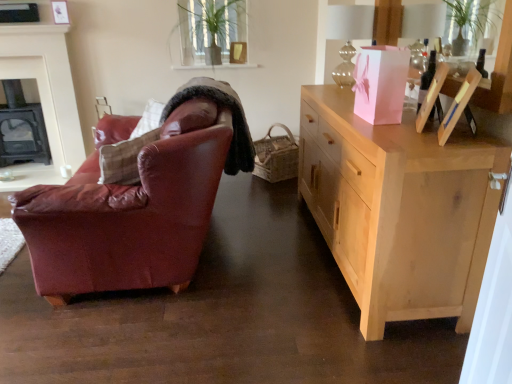
Locate an element on the screen. woven brown picnic basket at center is located at coordinates (276, 156).

The height and width of the screenshot is (384, 512). What do you see at coordinates (45, 92) in the screenshot?
I see `black cast iron fireplace at left, which is the first fireplace from front to back` at bounding box center [45, 92].

Identify the location of natural wood cabinet at right. (399, 209).

From the image's perspective, which is above, green leafy plant at upper center or natural wood cabinet at right?

green leafy plant at upper center, from the image's perspective.

Is point (191, 45) behind point (490, 207)?

That is True.

The height and width of the screenshot is (384, 512). In the image, there is a natural wood cabinet at right. Find the location of `plant above it (from the image's perspective)`. plant above it (from the image's perspective) is located at coordinates (210, 28).

Is green leafy plant at upper center oriented away from natural wood cabinet at right?

green leafy plant at upper center is not turned away from natural wood cabinet at right.

Is black cast iron fireplace at left, the 2th fireplace in the front-to-back sequence, positioned with its back to green leafy plant at upper center?

No, black cast iron fireplace at left, the 2th fireplace in the front-to-back sequence, is not facing away from green leafy plant at upper center.

Does point (42, 156) come closer to viewer compared to point (187, 60)?

No, it is behind (187, 60).

Would you say black cast iron fireplace at left, the 2th fireplace in the front-to-back sequence, is outside green leafy plant at upper center?

Yes, black cast iron fireplace at left, the 2th fireplace in the front-to-back sequence, is outside of green leafy plant at upper center.

What's the angular difference between black cast iron fireplace at left, the 2th fireplace in the front-to-back sequence, and black cast iron fireplace at left, which is the first fireplace from front to back,'s facing directions?

black cast iron fireplace at left, the 2th fireplace in the front-to-back sequence, and black cast iron fireplace at left, which is the first fireplace from front to back, are facing 0.765 degrees away from each other.

Does point (24, 141) come in front of point (69, 85)?

That is False.

Can you confirm if black cast iron fireplace at left, the 2th fireplace in the front-to-back sequence, is positioned to the right of black cast iron fireplace at left, the 2th fireplace from the back?

No.

Could you tell me if black cast iron fireplace at left, the 2th fireplace in the front-to-back sequence, is turned towards black cast iron fireplace at left, which is the first fireplace from front to back?

Yes, black cast iron fireplace at left, the 2th fireplace in the front-to-back sequence, faces towards black cast iron fireplace at left, which is the first fireplace from front to back.

Considering the relative sizes of green leafy plant at upper center and woven brown picnic basket at center in the image provided, is green leafy plant at upper center bigger than woven brown picnic basket at center?

Yes.

Would you say woven brown picnic basket at center is part of green leafy plant at upper center's contents?

No, woven brown picnic basket at center is not a part of green leafy plant at upper center.

Which object is positioned more to the left, green leafy plant at upper center or woven brown picnic basket at center?

Positioned to the left is green leafy plant at upper center.

Considering the relative sizes of woven brown picnic basket at center and black cast iron fireplace at left, the 2th fireplace from the back, in the image provided, is woven brown picnic basket at center smaller than black cast iron fireplace at left, the 2th fireplace from the back,?

No.

Is woven brown picnic basket at center far away from black cast iron fireplace at left, the 2th fireplace from the back?

That's right, there is a large distance between woven brown picnic basket at center and black cast iron fireplace at left, the 2th fireplace from the back.

From the image's perspective, which is above, woven brown picnic basket at center or black cast iron fireplace at left, which is the first fireplace from front to back?

black cast iron fireplace at left, which is the first fireplace from front to back, is shown above in the image.

Considering the sizes of objects black cast iron fireplace at left, the 2th fireplace in the front-to-back sequence, and natural wood cabinet at right in the image provided, who is smaller, black cast iron fireplace at left, the 2th fireplace in the front-to-back sequence, or natural wood cabinet at right?

Smaller between the two is black cast iron fireplace at left, the 2th fireplace in the front-to-back sequence.

Between black cast iron fireplace at left, the 2th fireplace in the front-to-back sequence, and natural wood cabinet at right, which one appears on the left side from the viewer's perspective?

Positioned to the left is black cast iron fireplace at left, the 2th fireplace in the front-to-back sequence.

Is natural wood cabinet at right at the back of black cast iron fireplace at left, the 2th fireplace in the front-to-back sequence?

No, black cast iron fireplace at left, the 2th fireplace in the front-to-back sequence, is not facing away from natural wood cabinet at right.

Can you confirm if woven brown picnic basket at center is taller than black cast iron fireplace at left, marked as the 1th fireplace in a back-to-front arrangement?

No.

Does woven brown picnic basket at center appear on the right side of black cast iron fireplace at left, the 2th fireplace in the front-to-back sequence?

Yes, woven brown picnic basket at center is to the right of black cast iron fireplace at left, the 2th fireplace in the front-to-back sequence.

Does woven brown picnic basket at center have a greater width compared to black cast iron fireplace at left, the 2th fireplace in the front-to-back sequence?

Indeed, woven brown picnic basket at center has a greater width compared to black cast iron fireplace at left, the 2th fireplace in the front-to-back sequence.

Looking at this image, is black cast iron fireplace at left, the 2th fireplace in the front-to-back sequence, inside woven brown picnic basket at center?

That's incorrect, black cast iron fireplace at left, the 2th fireplace in the front-to-back sequence, is not inside woven brown picnic basket at center.

The width and height of the screenshot is (512, 384). In the image, there is a natural wood cabinet at right. In order to click on plant above it (from the image's perspective) in this screenshot , I will do `click(210, 28)`.

I want to click on the 2nd fireplace positioned below the green leafy plant at upper center (from the image's perspective), so click(x=21, y=128).

Based on their spatial positions, is black cast iron fireplace at left, marked as the 1th fireplace in a back-to-front arrangement, or natural wood cabinet at right further from black cast iron fireplace at left, the 2th fireplace from the back?

natural wood cabinet at right.

Considering their positions, is black cast iron fireplace at left, which is the first fireplace from front to back, positioned closer to black cast iron fireplace at left, marked as the 1th fireplace in a back-to-front arrangement, than natural wood cabinet at right?

black cast iron fireplace at left, which is the first fireplace from front to back, is positioned closer to the anchor black cast iron fireplace at left, marked as the 1th fireplace in a back-to-front arrangement.

Based on their spatial positions, is natural wood cabinet at right or black cast iron fireplace at left, marked as the 1th fireplace in a back-to-front arrangement, further from woven brown picnic basket at center?

black cast iron fireplace at left, marked as the 1th fireplace in a back-to-front arrangement, is positioned further to the anchor woven brown picnic basket at center.

Looking at the image, which one is located closer to natural wood cabinet at right, black cast iron fireplace at left, the 2th fireplace in the front-to-back sequence, or woven brown picnic basket at center?

woven brown picnic basket at center is closer to natural wood cabinet at right.

Which object lies nearer to the anchor point black cast iron fireplace at left, the 2th fireplace in the front-to-back sequence, woven brown picnic basket at center or black cast iron fireplace at left, the 2th fireplace from the back?

The object closer to black cast iron fireplace at left, the 2th fireplace in the front-to-back sequence, is black cast iron fireplace at left, the 2th fireplace from the back.

From the image, which object appears to be nearer to natural wood cabinet at right, woven brown picnic basket at center or black cast iron fireplace at left, the 2th fireplace in the front-to-back sequence?

woven brown picnic basket at center lies closer to natural wood cabinet at right than the other object.

Based on their spatial positions, is natural wood cabinet at right or black cast iron fireplace at left, which is the first fireplace from front to back, further from green leafy plant at upper center?

natural wood cabinet at right.

Based on their spatial positions, is green leafy plant at upper center or woven brown picnic basket at center closer to black cast iron fireplace at left, the 2th fireplace in the front-to-back sequence?

green leafy plant at upper center is positioned closer to the anchor black cast iron fireplace at left, the 2th fireplace in the front-to-back sequence.

This screenshot has height=384, width=512. Find the location of `plant located between black cast iron fireplace at left, which is the first fireplace from front to back, and natural wood cabinet at right in the left-right direction`. plant located between black cast iron fireplace at left, which is the first fireplace from front to back, and natural wood cabinet at right in the left-right direction is located at coordinates (210, 28).

Where is `plant between black cast iron fireplace at left, the 2th fireplace in the front-to-back sequence, and natural wood cabinet at right, in the horizontal direction`? plant between black cast iron fireplace at left, the 2th fireplace in the front-to-back sequence, and natural wood cabinet at right, in the horizontal direction is located at coordinates (210, 28).

Where is `picnic basket between black cast iron fireplace at left, the 2th fireplace in the front-to-back sequence, and natural wood cabinet at right`? picnic basket between black cast iron fireplace at left, the 2th fireplace in the front-to-back sequence, and natural wood cabinet at right is located at coordinates pos(276,156).

Locate an element on the screen. fireplace between black cast iron fireplace at left, the 2th fireplace in the front-to-back sequence, and natural wood cabinet at right from left to right is located at coordinates (45, 92).